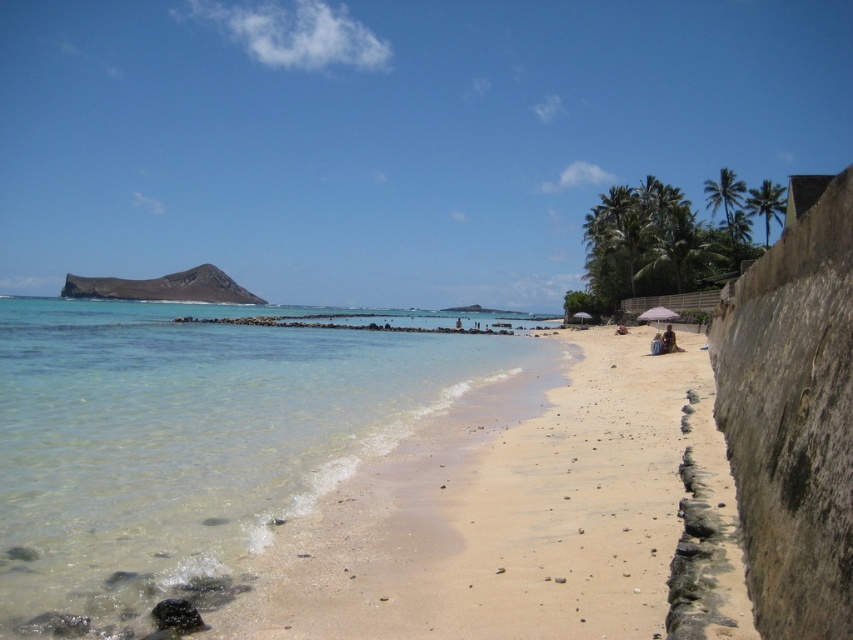
Find the location of a particular element. Image resolution: width=853 pixels, height=640 pixels. sandy beach at lower right is located at coordinates (527, 518).

Who is taller, sandy beach at lower right or blue denim shorts at lower right?

Standing taller between the two is sandy beach at lower right.

Does point (474, 417) come in front of point (654, 333)?

That is True.

Find the location of a particular element. sandy beach at lower right is located at coordinates (527, 518).

Which is more to the left, clear water at lower left or sandy beach at lower right?

clear water at lower left

Does point (253, 346) come farther from viewer compared to point (508, 381)?

Yes, point (253, 346) is farther from viewer.

Where is `clear water at lower left`? clear water at lower left is located at coordinates (187, 444).

Which is above, purple fabric umbrella at lower right or beige sand at beach center?

purple fabric umbrella at lower right is higher up.

Is purple fabric umbrella at lower right shorter than beige sand at beach center?

Incorrect, purple fabric umbrella at lower right's height does not fall short of beige sand at beach center's.

You are a GUI agent. You are given a task and a screenshot of the screen. Output one action in this format:
    pyautogui.click(x=<x>, y=<y>)
    Task: Click on the purple fabric umbrella at lower right
    The height and width of the screenshot is (640, 853).
    Given the screenshot: What is the action you would take?
    pyautogui.click(x=657, y=314)